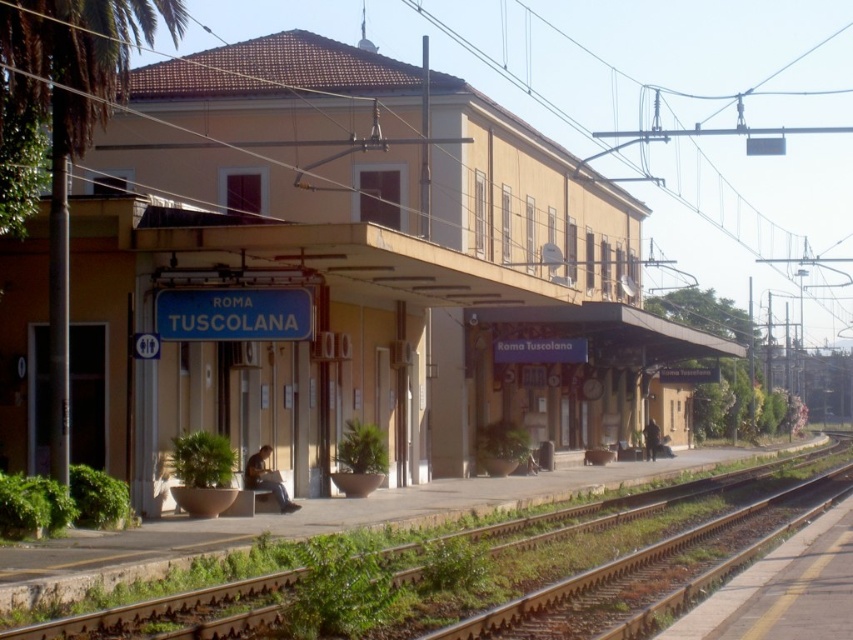
Question: Is green grass at lower left to the left of green leafy palm tree at left from the viewer's perspective?

Choices:
 (A) yes
 (B) no

Answer: (B)

Question: Which point is closer to the camera taking this photo?

Choices:
 (A) (665, 566)
 (B) (67, 132)
 (C) (361, 632)

Answer: (C)

Question: Observing the image, what is the correct spatial positioning of yellow matte building at center in reference to green grass at lower left?

Choices:
 (A) left
 (B) right

Answer: (A)

Question: Which of the following is the closest to the observer?

Choices:
 (A) (651, 326)
 (B) (700, 512)
 (C) (102, 86)

Answer: (C)

Question: Among these objects, which one is nearest to the camera?

Choices:
 (A) yellow matte building at center
 (B) brown gravel track at lower right
 (C) green grass at lower left

Answer: (C)

Question: Does green grass at lower left appear on the left side of brown gravel track at lower right?

Choices:
 (A) yes
 (B) no

Answer: (B)